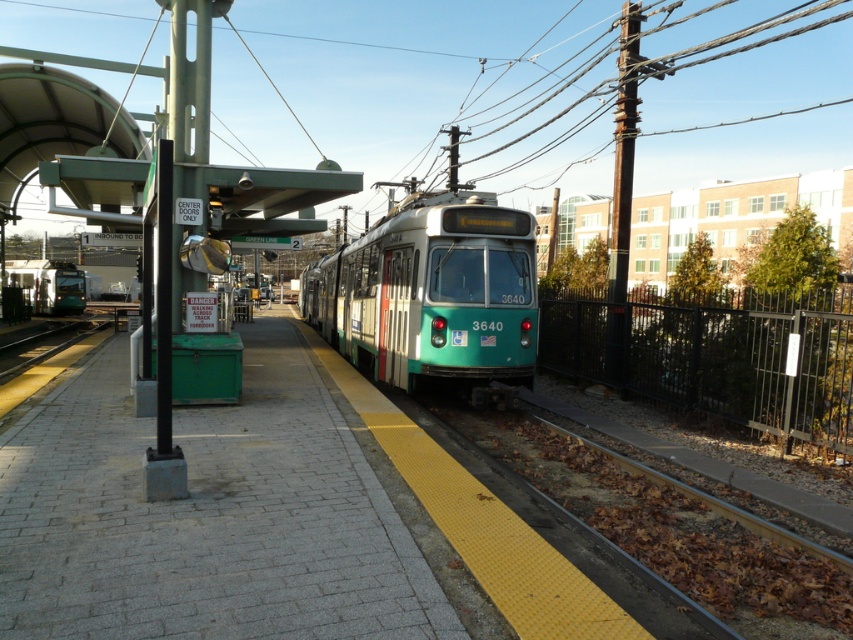
Who is higher up, green matte train at center or green matte train at left?

Positioned higher is green matte train at left.

Is green matte train at center shorter than green matte train at left?

Indeed, green matte train at center has a lesser height compared to green matte train at left.

Locate an element on the screen. green matte train at center is located at coordinates (432, 292).

At what (x,y) coordinates should I click in order to perform the action: click on green matte train at center. Please return your answer as a coordinate pair (x, y). Looking at the image, I should click on (432, 292).

Is point (370, 566) farther from camera compared to point (374, 339)?

No, (370, 566) is closer to viewer.

Between brick platform at center and green matte train at center, which one appears on the right side from the viewer's perspective?

brick platform at center

Which is behind, point (317, 608) or point (358, 298)?

Positioned behind is point (358, 298).

At what (x,y) coordinates should I click in order to perform the action: click on brick platform at center. Please return your answer as a coordinate pair (x, y). The width and height of the screenshot is (853, 640). Looking at the image, I should click on (206, 515).

Who is more forward, (x=294, y=339) or (x=62, y=272)?

Positioned in front is point (x=294, y=339).

Can you confirm if brick platform at center is bigger than green matte train at left?

Incorrect, brick platform at center is not larger than green matte train at left.

Where is `brick platform at center`? brick platform at center is located at coordinates (206, 515).